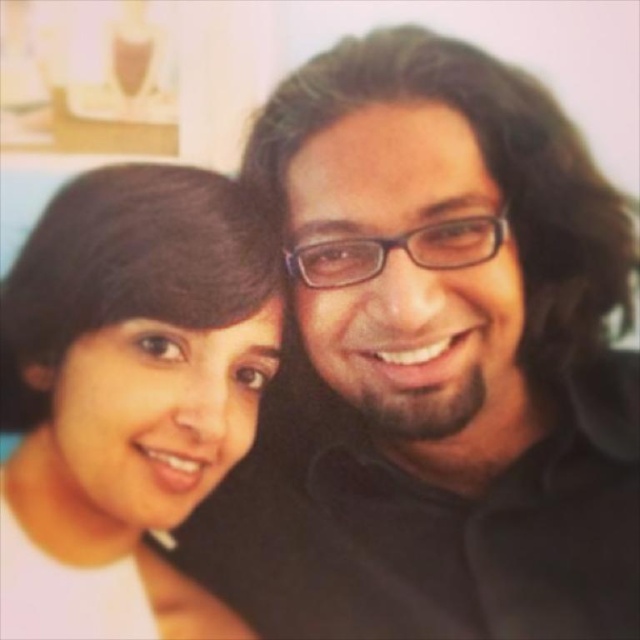
Question: Is black matte shirt at center bigger than matte white shirt at left?

Choices:
 (A) yes
 (B) no

Answer: (A)

Question: Among these points, which one is farthest from the camera?

Choices:
 (A) (90, 625)
 (B) (396, 525)

Answer: (B)

Question: Is black matte shirt at center bigger than matte white shirt at left?

Choices:
 (A) no
 (B) yes

Answer: (B)

Question: Which of the following is the closest to the observer?

Choices:
 (A) matte white shirt at left
 (B) black matte shirt at center

Answer: (A)

Question: Does black matte shirt at center appear on the left side of matte white shirt at left?

Choices:
 (A) no
 (B) yes

Answer: (A)

Question: Which point appears farthest from the camera in this image?

Choices:
 (A) (365, 336)
 (B) (35, 317)

Answer: (B)